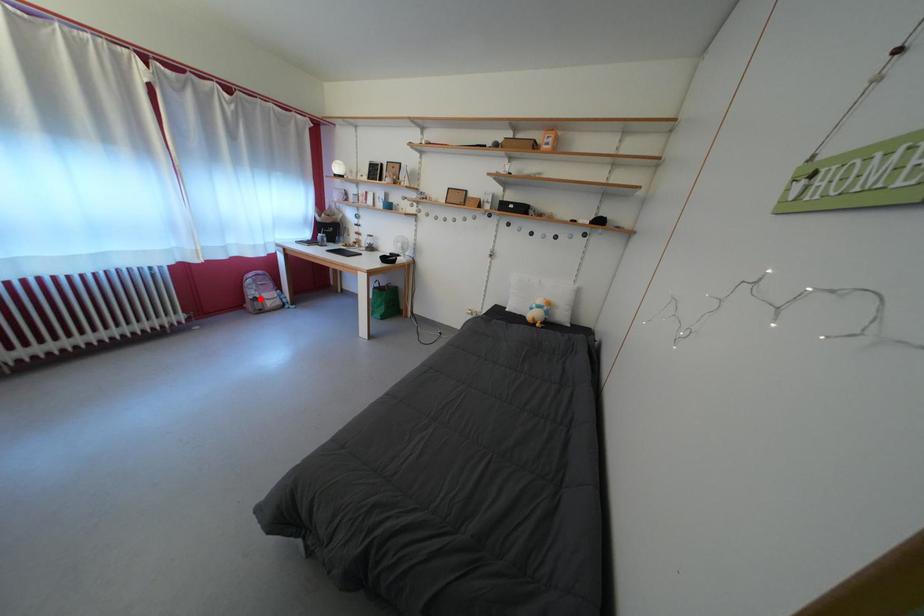
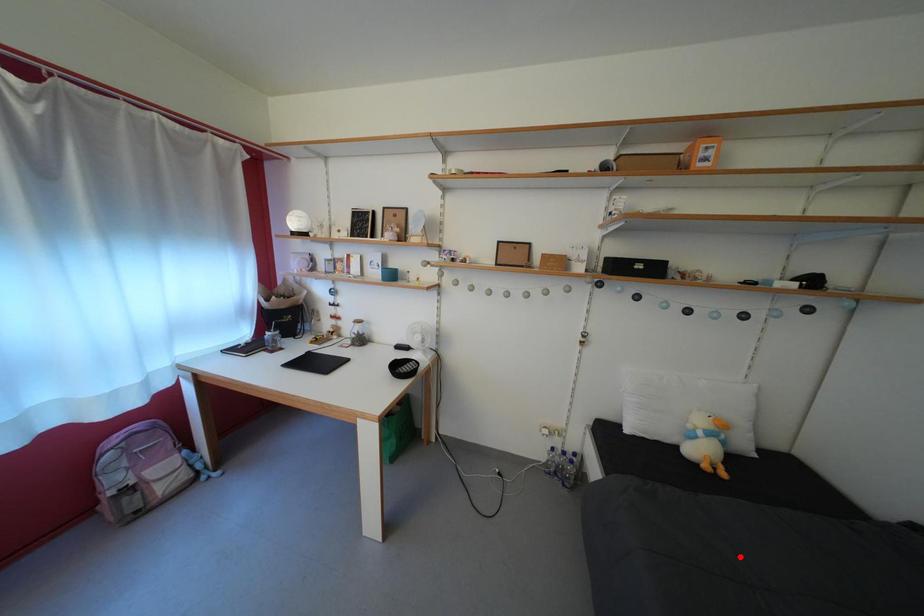
I am providing you with two images of the same scene from different viewpoints. A red point is marked on the first image and another point is marked on the second image. Are the points marked in image1 and image2 representing the same 3D position?

No